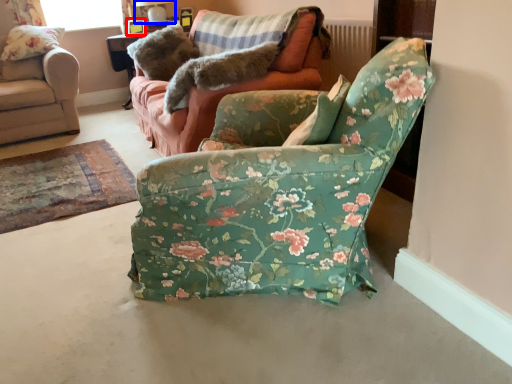
Question: Which object appears farthest to the camera in this image, picture frame (highlighted by a red box) or lamp (highlighted by a blue box)?

Choices:
 (A) picture frame
 (B) lamp

Answer: (A)